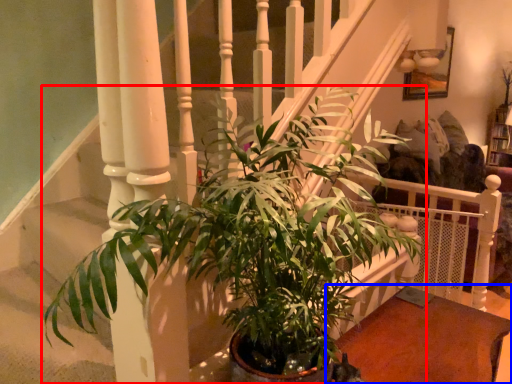
Question: Which point is further to the camera, houseplant (highlighted by a red box) or table (highlighted by a blue box)?

Choices:
 (A) houseplant
 (B) table

Answer: (B)